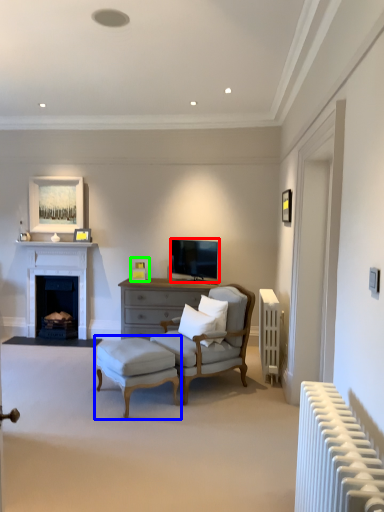
Question: Which object is the closest to the television (highlighted by a red box)? Choose among these: table (highlighted by a blue box) or picture frame (highlighted by a green box).

Choices:
 (A) table
 (B) picture frame

Answer: (B)